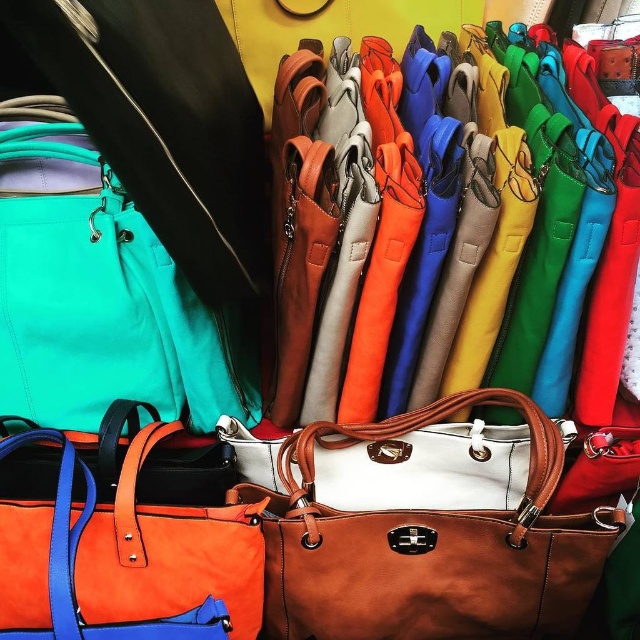
You are a store employee arranging handbags. You have a brown leather tote at center and an orange leather tote at center. Which one is wider?

The brown leather tote at center is wider than the orange leather tote at center.

You are a customer looking to organize your handbags. You have a brown leather tote at center and an orange leather tote at center. Which one should you place to the left if you want them in order from left to right?

The orange leather tote at center should be placed to the left of the brown leather tote at center since the brown leather tote at center is positioned on the right side of the orange leather tote at center according to the description.

You are a customer in a store looking at the brown leather tote at center and the orange leather tote at center. Which one is closer to you?

The brown leather tote at center is closer to you since the orange leather tote at center is behind it.